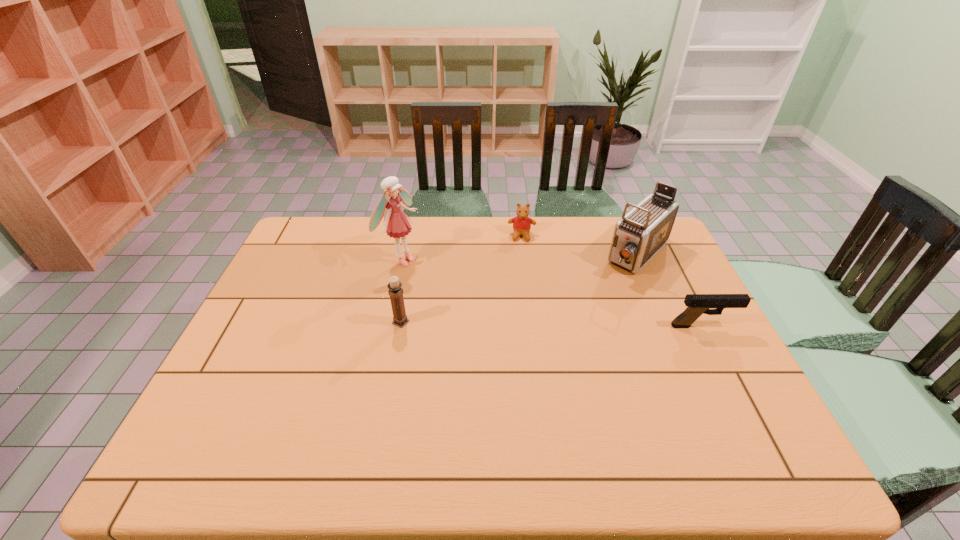
In order to click on free space that satisfies the following two spatial constraints: 1. on the back side of the third object from right to left; 2. on the left side of the tallest object in this screenshot , I will do `click(406, 236)`.

I want to click on blank space that satisfies the following two spatial constraints: 1. on the front side of the second tallest object; 2. on the front-facing side of the pistol, so click(670, 326).